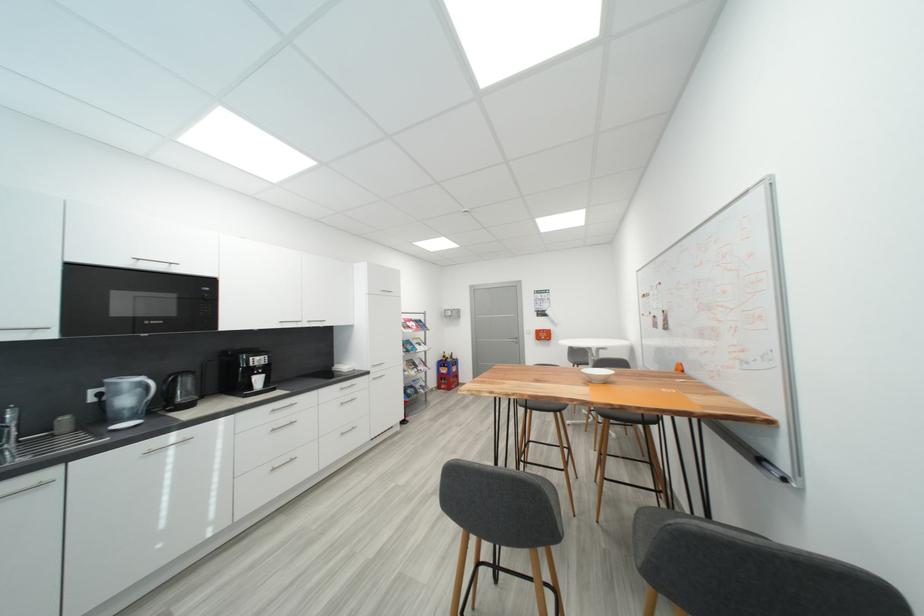
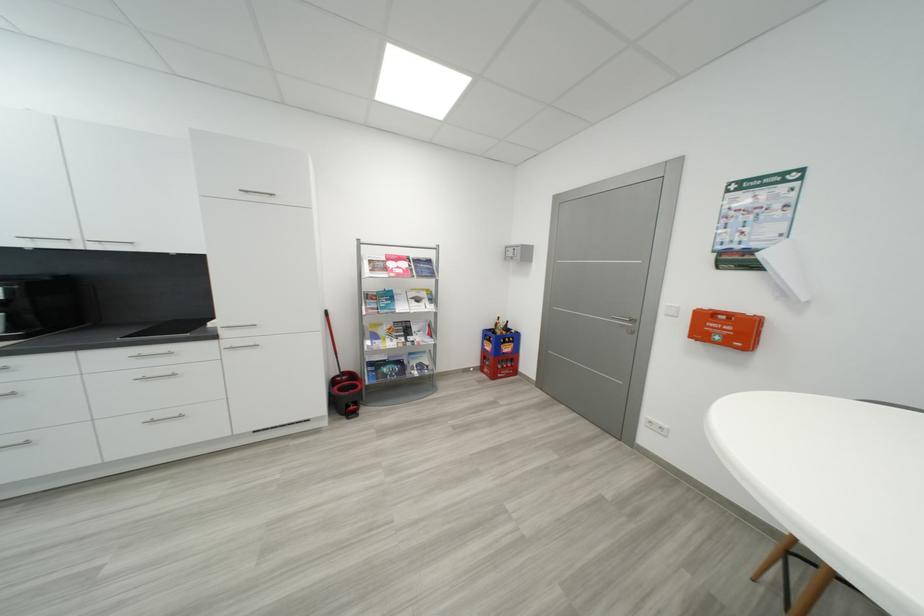
Find the pixel in the second image that matches pixel 416 329 in the first image.

(393, 270)